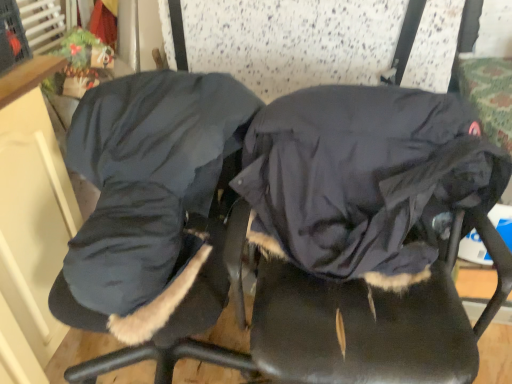
Question: Is dark blue fleece sleeping bag at center located outside velvet-like dark blue coat at center?

Choices:
 (A) yes
 (B) no

Answer: (B)

Question: Does dark blue fleece sleeping bag at center come in front of velvet-like dark blue coat at center?

Choices:
 (A) yes
 (B) no

Answer: (B)

Question: Does dark blue fleece sleeping bag at center have a larger size compared to velvet-like dark blue coat at center?

Choices:
 (A) yes
 (B) no

Answer: (B)

Question: Can you confirm if dark blue fleece sleeping bag at center is shorter than velvet-like dark blue coat at center?

Choices:
 (A) no
 (B) yes

Answer: (B)

Question: From a real-world perspective, does dark blue fleece sleeping bag at center sit lower than velvet-like dark blue coat at center?

Choices:
 (A) yes
 (B) no

Answer: (B)

Question: Is velvet-like dark blue coat at center wider or thinner than dark gray fabric coat at center?

Choices:
 (A) wide
 (B) thin

Answer: (A)

Question: From a real-world perspective, is velvet-like dark blue coat at center physically located above or below dark gray fabric coat at center?

Choices:
 (A) below
 (B) above

Answer: (A)

Question: Relative to dark gray fabric coat at center, is velvet-like dark blue coat at center in front or behind?

Choices:
 (A) behind
 (B) front

Answer: (B)

Question: Based on their sizes in the image, would you say velvet-like dark blue coat at center is bigger or smaller than dark gray fabric coat at center?

Choices:
 (A) big
 (B) small

Answer: (A)

Question: Considering their positions, is dark blue fleece sleeping bag at center located in front of or behind dark gray fabric coat at center?

Choices:
 (A) front
 (B) behind

Answer: (B)

Question: Is dark blue fleece sleeping bag at center wider or thinner than dark gray fabric coat at center?

Choices:
 (A) thin
 (B) wide

Answer: (A)

Question: In terms of height, does dark blue fleece sleeping bag at center look taller or shorter compared to dark gray fabric coat at center?

Choices:
 (A) short
 (B) tall

Answer: (A)

Question: From a real-world perspective, is dark blue fleece sleeping bag at center physically located above or below dark gray fabric coat at center?

Choices:
 (A) below
 (B) above

Answer: (A)

Question: Looking at the image, does velvet-like dark blue coat at center seem bigger or smaller compared to dark blue fleece sleeping bag at center?

Choices:
 (A) big
 (B) small

Answer: (A)

Question: Is velvet-like dark blue coat at center in front of or behind dark blue fleece sleeping bag at center in the image?

Choices:
 (A) behind
 (B) front

Answer: (B)